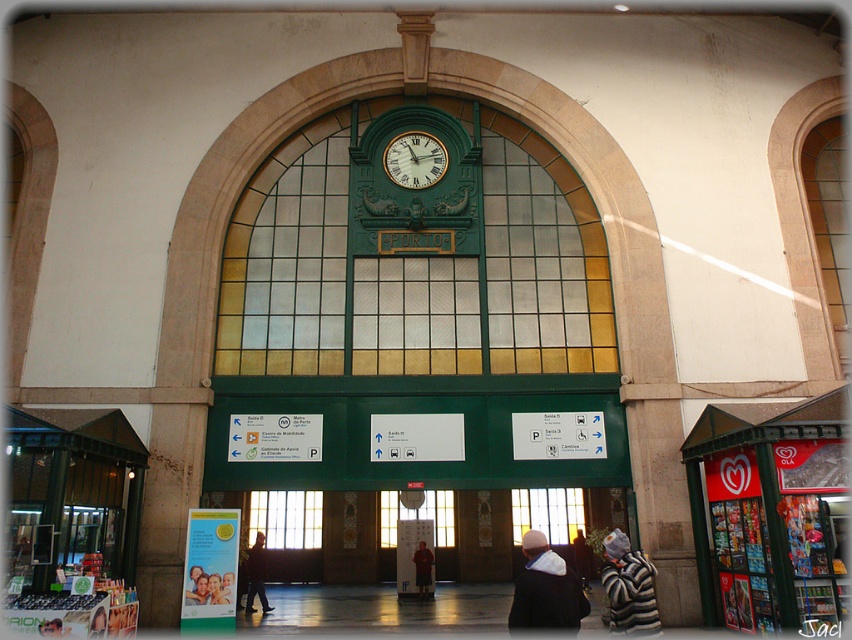
Question: Can you confirm if green glass window at center is wider than dark brown leather jacket at center?

Choices:
 (A) yes
 (B) no

Answer: (A)

Question: Can you confirm if green glass window at center is smaller than striped sweater at center?

Choices:
 (A) yes
 (B) no

Answer: (B)

Question: Which of these objects is positioned farthest from the translucent glass window at center?

Choices:
 (A) striped woolen sweater at lower right
 (B) green glass window at center
 (C) metallic green vending machine at center

Answer: (A)

Question: Which point is closer to the camera?

Choices:
 (A) (659, 632)
 (B) (412, 307)
 (C) (729, 497)
 (D) (533, 589)

Answer: (D)

Question: Which of the following is the farthest from the observer?

Choices:
 (A) (424, 234)
 (B) (530, 564)
 (C) (545, 515)

Answer: (C)

Question: Can you confirm if dark blue jacket at lower center is positioned to the right of translucent glass window at center?

Choices:
 (A) no
 (B) yes

Answer: (B)